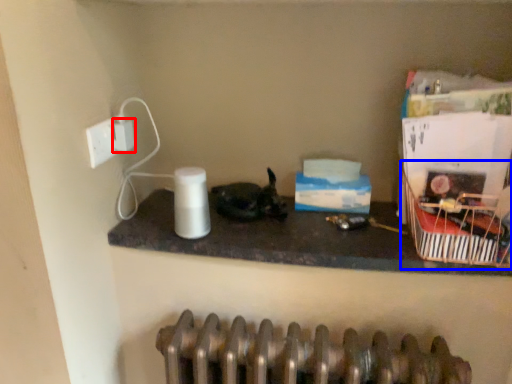
Question: Among these objects, which one is farthest to the camera, electric outlet (highlighted by a red box) or basket (highlighted by a blue box)?

Choices:
 (A) electric outlet
 (B) basket

Answer: (A)